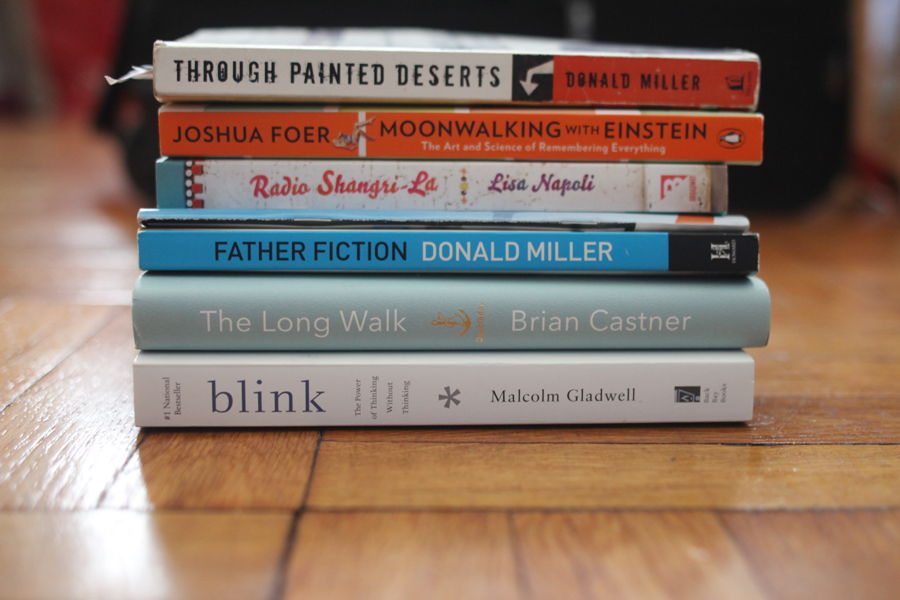
You are a GUI agent. You are given a task and a screenshot of the screen. Output one action in this format:
    pyautogui.click(x=<x>, y=<y>)
    Task: Click on the horizontally laying book
    This screenshot has width=900, height=600.
    Given the screenshot: What is the action you would take?
    pyautogui.click(x=378, y=394), pyautogui.click(x=379, y=333), pyautogui.click(x=380, y=255), pyautogui.click(x=380, y=222), pyautogui.click(x=387, y=190), pyautogui.click(x=393, y=154), pyautogui.click(x=408, y=79)